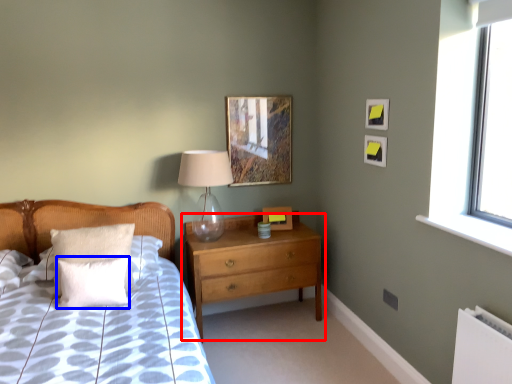
Question: Which object is further to the camera taking this photo, chest of drawers (highlighted by a red box) or pillow (highlighted by a blue box)?

Choices:
 (A) chest of drawers
 (B) pillow

Answer: (A)